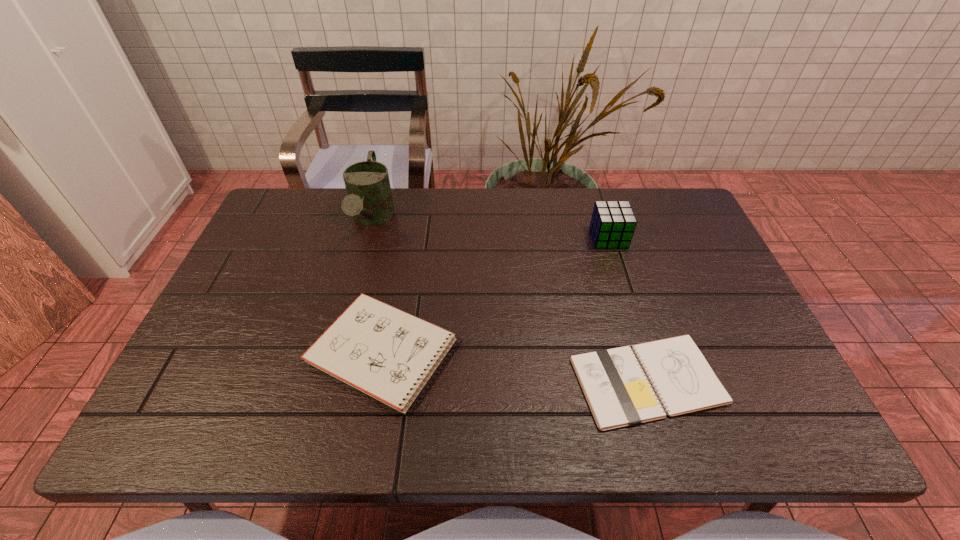
Where is `watering can located in the far edge section of the desktop`? The height and width of the screenshot is (540, 960). watering can located in the far edge section of the desktop is located at coordinates tap(369, 200).

You are a GUI agent. You are given a task and a screenshot of the screen. Output one action in this format:
    pyautogui.click(x=<x>, y=<y>)
    Task: Click on the cube located at the far edge
    
    Given the screenshot: What is the action you would take?
    pyautogui.click(x=612, y=225)

Locate an element on the screen. Image resolution: width=960 pixels, height=540 pixels. object at the right edge is located at coordinates (618, 393).

Identify the location of object positioned at the near right corner. The width and height of the screenshot is (960, 540). (618, 393).

Find the location of a particular element. free spot at the far edge of the desktop is located at coordinates (516, 219).

Locate an element on the screen. This screenshot has height=540, width=960. vacant space at the right edge of the desktop is located at coordinates (693, 320).

Identify the location of vacant area at the far left corner. This screenshot has height=540, width=960. (292, 225).

In the image, there is a desktop. At what (x,y) coordinates should I click in order to perform the action: click on vacant space at the near left corner. Please return your answer as a coordinate pair (x, y). This screenshot has width=960, height=540. Looking at the image, I should click on (239, 410).

Locate an element on the screen. The height and width of the screenshot is (540, 960). vacant space at the near right corner is located at coordinates (742, 431).

The image size is (960, 540). In order to click on vacant space that is in between the tallest object and the cube in this screenshot , I will do (x=491, y=229).